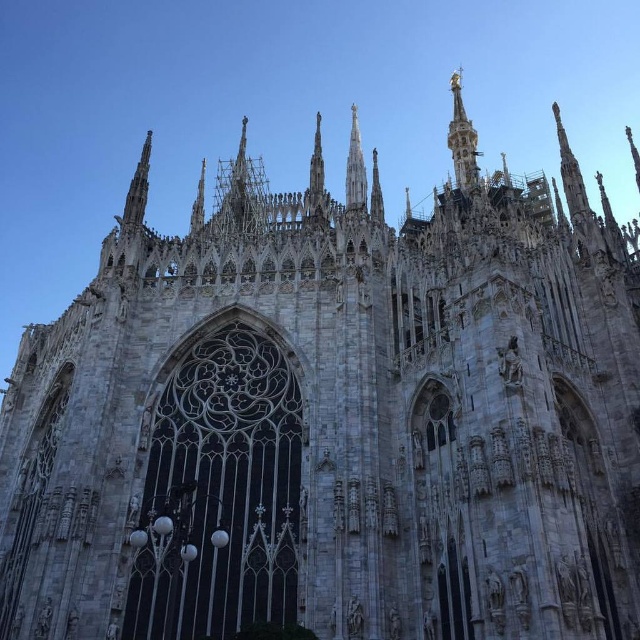
Who is more forward, (465, 125) or (349, 157)?

Point (349, 157) is more forward.

Between point (474, 147) and point (346, 168), which one is positioned behind?

The point (346, 168) is more distant.

Describe the element at coordinates (461, 138) in the screenshot. I see `gold polished spire at upper center` at that location.

This screenshot has width=640, height=640. Identify the location of gold polished spire at upper center. (461, 138).